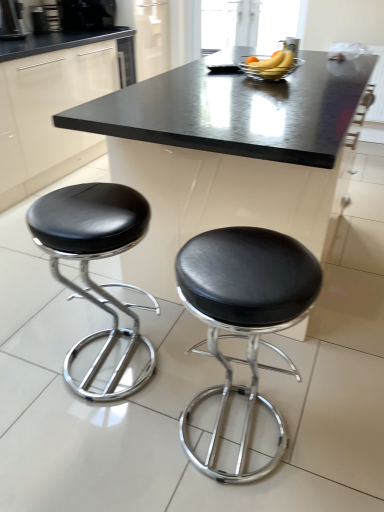
This screenshot has width=384, height=512. I want to click on metallic silver coffee maker at upper left, the 1th appliance from the left, so click(x=38, y=20).

What is the approximate height of black plastic coffee machine at upper left, which appears as the 1th coffee machine when viewed from the left?

black plastic coffee machine at upper left, which appears as the 1th coffee machine when viewed from the left, is 10.27 inches in height.

The image size is (384, 512). Describe the element at coordinates (11, 20) in the screenshot. I see `black plastic coffee machine at upper left, which appears as the 2th coffee machine when viewed from the top` at that location.

What do you see at coordinates (94, 258) in the screenshot? The width and height of the screenshot is (384, 512). I see `black leather stool at left, the 2th stool in the right-to-left sequence` at bounding box center [94, 258].

How much space does black leather stool at lower right, marked as the 2th stool in a left-to-right arrangement, occupy horizontally?

It is 39.69 centimeters.

This screenshot has height=512, width=384. Describe the element at coordinates (86, 14) in the screenshot. I see `black plastic coffee machine at upper left, the second coffee machine from the front` at that location.

What do you see at coordinates (226, 153) in the screenshot? The height and width of the screenshot is (512, 384). I see `black marble table at center` at bounding box center [226, 153].

You are a GUI agent. You are given a task and a screenshot of the screen. Output one action in this format:
    pyautogui.click(x=<x>, y=<y>)
    Task: Click on the metallic silver coffee maker at upper left, placed as the 2th appliance when sorted from right to left
    The image size is (384, 512).
    Given the screenshot: What is the action you would take?
    pyautogui.click(x=38, y=20)

From a real-world perspective, which is physically below, brushed metal coffee maker at upper left, which is the 1th appliance in right-to-left order, or black leather stool at left, the 2th stool in the right-to-left sequence?

black leather stool at left, the 2th stool in the right-to-left sequence, from a real-world perspective.

Considering the sizes of objects brushed metal coffee maker at upper left, which is the second appliance from left to right, and black leather stool at left, the first stool positioned from the left, in the image provided, who is shorter, brushed metal coffee maker at upper left, which is the second appliance from left to right, or black leather stool at left, the first stool positioned from the left,?

brushed metal coffee maker at upper left, which is the second appliance from left to right, is shorter.

Identify the location of the 1st stool in front of the brushed metal coffee maker at upper left, which is the second appliance from left to right, counting from the anchor's position. (94, 258).

Which object is thinner, brushed metal coffee maker at upper left, which is the 1th appliance in right-to-left order, or black leather stool at left, the 2th stool in the right-to-left sequence?

brushed metal coffee maker at upper left, which is the 1th appliance in right-to-left order.

Which of these two, black leather stool at lower right, marked as the 2th stool in a left-to-right arrangement, or metallic silver coffee maker at upper left, the 1th appliance from the left, is thinner?

With smaller width is metallic silver coffee maker at upper left, the 1th appliance from the left.

Which is behind, black leather stool at lower right, marked as the first stool in a right-to-left arrangement, or metallic silver coffee maker at upper left, the 1th appliance from the left?

metallic silver coffee maker at upper left, the 1th appliance from the left, is more distant.

Between black leather stool at lower right, marked as the first stool in a right-to-left arrangement, and metallic silver coffee maker at upper left, the 1th appliance from the left, which one has less height?

Standing shorter between the two is metallic silver coffee maker at upper left, the 1th appliance from the left.

Can you confirm if black leather stool at left, the first stool positioned from the left, is bigger than black marble table at center?

No.

Considering the positions of point (48, 219) and point (320, 119), is point (48, 219) closer or farther from the camera than point (320, 119)?

Clearly, point (48, 219) is closer to the camera than point (320, 119).

From the image's perspective, is black leather stool at left, the 2th stool in the right-to-left sequence, located beneath black marble table at center?

Indeed, from the image's perspective, black leather stool at left, the 2th stool in the right-to-left sequence, is shown beneath black marble table at center.

From the image's perspective, which is below, black leather stool at lower right, marked as the 2th stool in a left-to-right arrangement, or brushed metal coffee maker at upper left, which is the 1th appliance in right-to-left order?

From the image's view, black leather stool at lower right, marked as the 2th stool in a left-to-right arrangement, is below.

How much distance is there between black leather stool at lower right, marked as the first stool in a right-to-left arrangement, and brushed metal coffee maker at upper left, which is the 1th appliance in right-to-left order?

black leather stool at lower right, marked as the first stool in a right-to-left arrangement, and brushed metal coffee maker at upper left, which is the 1th appliance in right-to-left order, are 3.11 meters apart.

Do you think black leather stool at lower right, marked as the first stool in a right-to-left arrangement, is within brushed metal coffee maker at upper left, which is the 1th appliance in right-to-left order, or outside of it?

The correct answer is: outside.

Considering the sizes of objects black leather stool at lower right, marked as the first stool in a right-to-left arrangement, and brushed metal coffee maker at upper left, which is the 1th appliance in right-to-left order, in the image provided, who is taller, black leather stool at lower right, marked as the first stool in a right-to-left arrangement, or brushed metal coffee maker at upper left, which is the 1th appliance in right-to-left order,?

With more height is black leather stool at lower right, marked as the first stool in a right-to-left arrangement.

Is the depth of black leather stool at lower right, marked as the first stool in a right-to-left arrangement, greater than that of black plastic coffee machine at upper left, which appears as the first coffee machine when viewed from the top?

No, the depth of black leather stool at lower right, marked as the first stool in a right-to-left arrangement, is less than that of black plastic coffee machine at upper left, which appears as the first coffee machine when viewed from the top.

Considering the points (196, 256) and (81, 13), which point is in front, point (196, 256) or point (81, 13)?

The point (196, 256) is closer.

From the image's perspective, would you say black leather stool at lower right, marked as the first stool in a right-to-left arrangement, is positioned over black plastic coffee machine at upper left, which appears as the first coffee machine when viewed from the top?

No, from the image's perspective, black leather stool at lower right, marked as the first stool in a right-to-left arrangement, is not on top of black plastic coffee machine at upper left, which appears as the first coffee machine when viewed from the top.

Looking at this image, considering the sizes of objects black leather stool at lower right, marked as the first stool in a right-to-left arrangement, and black plastic coffee machine at upper left, which appears as the first coffee machine when viewed from the top, in the image provided, who is smaller, black leather stool at lower right, marked as the first stool in a right-to-left arrangement, or black plastic coffee machine at upper left, which appears as the first coffee machine when viewed from the top,?

With smaller size is black plastic coffee machine at upper left, which appears as the first coffee machine when viewed from the top.

Based on the photo, which of these two, black marble table at center or black plastic coffee machine at upper left, arranged as the first coffee machine when viewed from the right, is bigger?

black marble table at center.

In the scene shown: Can you tell me how much black marble table at center and black plastic coffee machine at upper left, arranged as the first coffee machine when viewed from the right, differ in facing direction?

The facing directions of black marble table at center and black plastic coffee machine at upper left, arranged as the first coffee machine when viewed from the right, are 91 degrees apart.

Who is shorter, black marble table at center or black plastic coffee machine at upper left, arranged as the first coffee machine when viewed from the right?

black plastic coffee machine at upper left, arranged as the first coffee machine when viewed from the right.

Choose the correct answer: Is black marble table at center inside black plastic coffee machine at upper left, which ranks as the 2th coffee machine in bottom-to-top order, or outside it?

black marble table at center is not inside black plastic coffee machine at upper left, which ranks as the 2th coffee machine in bottom-to-top order, it's outside.

Between brushed metal coffee maker at upper left, which is the 1th appliance in right-to-left order, and yellow matte banana at upper center, which one appears on the right side from the viewer's perspective?

From the viewer's perspective, yellow matte banana at upper center appears more on the right side.

Does brushed metal coffee maker at upper left, which is the 1th appliance in right-to-left order, have a greater width compared to yellow matte banana at upper center?

No.

Considering the sizes of objects brushed metal coffee maker at upper left, which is the second appliance from left to right, and yellow matte banana at upper center in the image provided, who is shorter, brushed metal coffee maker at upper left, which is the second appliance from left to right, or yellow matte banana at upper center?

With less height is yellow matte banana at upper center.

This screenshot has width=384, height=512. There is a brushed metal coffee maker at upper left, which is the 1th appliance in right-to-left order. Identify the location of the 1st stool below it (from a real-world perspective). (94, 258).

From the black leather stool at lower right, marked as the first stool in a right-to-left arrangement, count the 2nd appliance to the left and point to it. Please provide its 2D coordinates.

[(38, 20)]

From the image, which object appears to be nearer to black marble table at center, black leather stool at left, the 2th stool in the right-to-left sequence, or yellow matte banana at upper center?

The object closer to black marble table at center is yellow matte banana at upper center.

Considering their positions, is metallic silver coffee maker at upper left, placed as the 2th appliance when sorted from right to left, positioned further to black plastic coffee machine at upper left, the 1th coffee machine viewed from the back, than black leather stool at lower right, marked as the 2th stool in a left-to-right arrangement?

black leather stool at lower right, marked as the 2th stool in a left-to-right arrangement, is positioned further to the anchor black plastic coffee machine at upper left, the 1th coffee machine viewed from the back.

Looking at the image, which one is located further to black plastic coffee machine at upper left, which appears as the 1th coffee machine when viewed from the left, black leather stool at left, the 2th stool in the right-to-left sequence, or metallic silver coffee maker at upper left, the 1th appliance from the left?

black leather stool at left, the 2th stool in the right-to-left sequence, lies further to black plastic coffee machine at upper left, which appears as the 1th coffee machine when viewed from the left, than the other object.

Looking at the image, which one is located further to black leather stool at left, the first stool positioned from the left, yellow matte banana at upper center or metallic silver coffee maker at upper left, the 1th appliance from the left?

metallic silver coffee maker at upper left, the 1th appliance from the left, is positioned further to the anchor black leather stool at left, the first stool positioned from the left.

Looking at this image, estimate the real-world distances between objects in this image. Which object is closer to black plastic coffee machine at upper left, which is the first coffee machine in front-to-back order, yellow matte banana at upper center or black leather stool at left, the 2th stool in the right-to-left sequence?

Among the two, yellow matte banana at upper center is located nearer to black plastic coffee machine at upper left, which is the first coffee machine in front-to-back order.

Which object lies nearer to the anchor point black leather stool at left, the 2th stool in the right-to-left sequence, black marble table at center or metallic silver coffee maker at upper left, the 1th appliance from the left?

Based on the image, black marble table at center appears to be nearer to black leather stool at left, the 2th stool in the right-to-left sequence.

Which object lies further to the anchor point yellow matte banana at upper center, black plastic coffee machine at upper left, which appears as the 1th coffee machine when viewed from the left, or black marble table at center?

Based on the image, black plastic coffee machine at upper left, which appears as the 1th coffee machine when viewed from the left, appears to be further to yellow matte banana at upper center.

Considering their positions, is brushed metal coffee maker at upper left, which is the second appliance from left to right, positioned closer to black leather stool at lower right, marked as the first stool in a right-to-left arrangement, than black plastic coffee machine at upper left, which ranks as the 2th coffee machine in bottom-to-top order?

Among the two, brushed metal coffee maker at upper left, which is the second appliance from left to right, is located nearer to black leather stool at lower right, marked as the first stool in a right-to-left arrangement.

The width and height of the screenshot is (384, 512). I want to click on coffee machine between black marble table at center and brushed metal coffee maker at upper left, which is the second appliance from left to right, in the front-back direction, so click(x=11, y=20).

Locate an element on the screen. The height and width of the screenshot is (512, 384). banana between black leather stool at lower right, marked as the first stool in a right-to-left arrangement, and black plastic coffee machine at upper left, the second coffee machine from the front, along the z-axis is located at coordinates (271, 65).

Where is `table that lies between yellow matte banana at upper center and black leather stool at left, the first stool positioned from the left, from top to bottom`? Image resolution: width=384 pixels, height=512 pixels. table that lies between yellow matte banana at upper center and black leather stool at left, the first stool positioned from the left, from top to bottom is located at coordinates (226, 153).

The height and width of the screenshot is (512, 384). Identify the location of table located between black leather stool at lower right, marked as the 2th stool in a left-to-right arrangement, and metallic silver coffee maker at upper left, placed as the 2th appliance when sorted from right to left, in the depth direction. (226, 153).